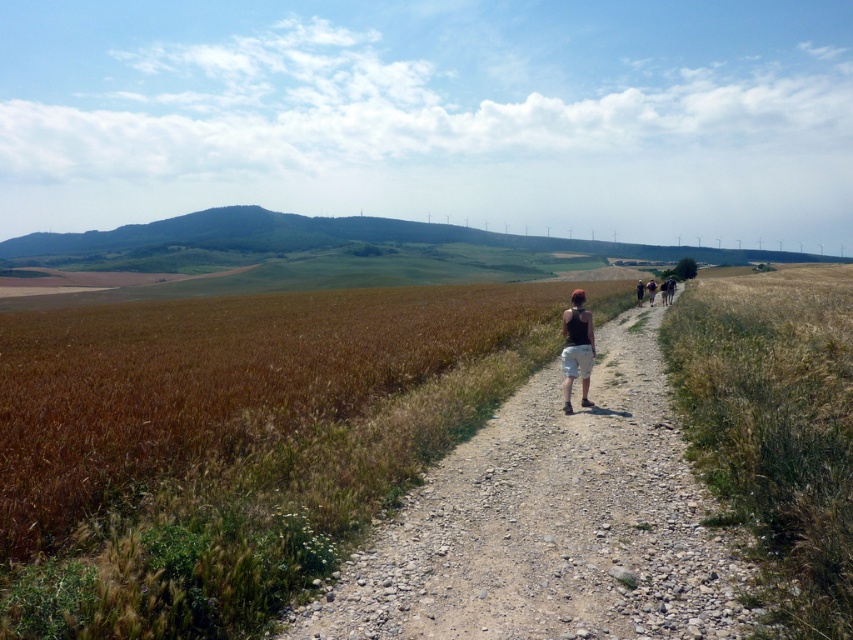
Question: Which point appears closest to the camera in this image?

Choices:
 (A) (514, 531)
 (B) (306, 522)
 (C) (572, 333)

Answer: (B)

Question: Which object is closer to the camera taking this photo?

Choices:
 (A) dirt path at center
 (B) dark brown shorts at center-right
 (C) matte black tank top at center
 (D) brown grassy field at center

Answer: (D)

Question: Does dirt path at center have a larger size compared to dark brown shorts at center-right?

Choices:
 (A) yes
 (B) no

Answer: (A)

Question: Does dirt path at center appear on the right side of brown cotton shorts at center-right?

Choices:
 (A) yes
 (B) no

Answer: (B)

Question: Which point is farther to the camera?

Choices:
 (A) (653, 296)
 (B) (407, 618)

Answer: (A)

Question: Can you confirm if brown grassy field at center is smaller than matte black tank top at center?

Choices:
 (A) no
 (B) yes

Answer: (A)